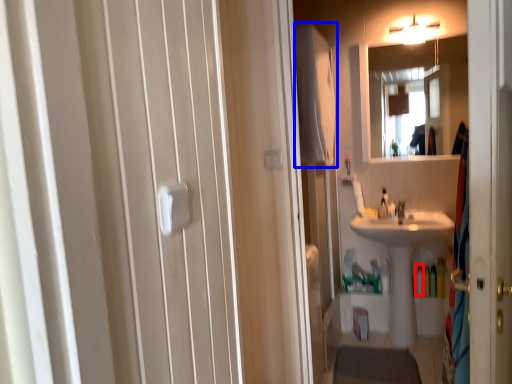
Question: Which point is further to the camera, toiletry (highlighted by a red box) or bath towel (highlighted by a blue box)?

Choices:
 (A) toiletry
 (B) bath towel

Answer: (A)